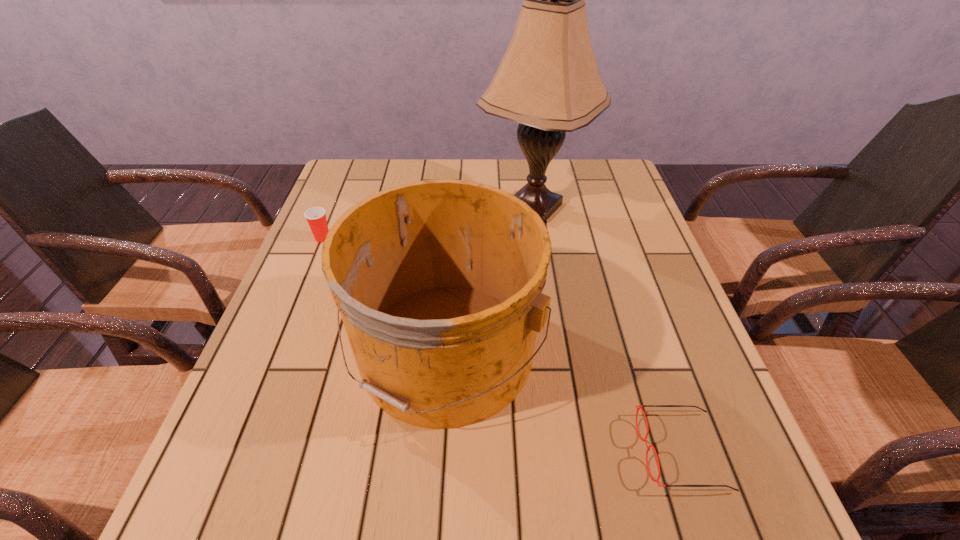
Find the location of a particular element. free location that satisfies the following two spatial constraints: 1. on the front side of the third shortest object; 2. on the right side of the Dixie cup is located at coordinates (276, 351).